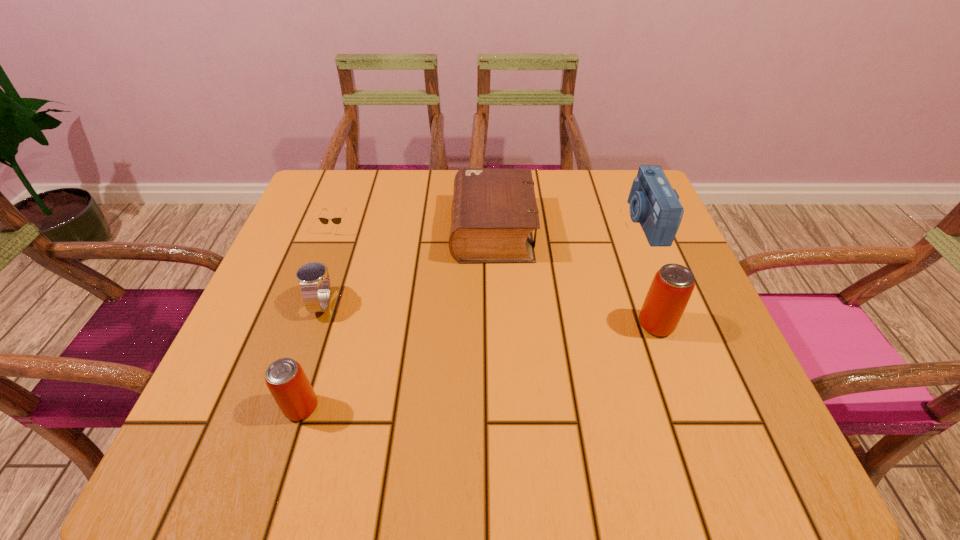
Find the location of a particular element. vacant space that satisfies the following two spatial constraints: 1. in front of the lenses of the sunglasses; 2. on the right side of the farther beer can is located at coordinates (302, 325).

You are a GUI agent. You are given a task and a screenshot of the screen. Output one action in this format:
    pyautogui.click(x=<x>, y=<y>)
    Task: Click on the vacant area that satisfies the following two spatial constraints: 1. in front of the lenses of the shortest object; 2. on the left side of the shorter beer can
    The image size is (960, 540).
    Given the screenshot: What is the action you would take?
    tap(273, 408)

Where is `vacant region that satisfies the following two spatial constraints: 1. on the spine side of the right beer can; 2. on the left side of the Bible`? vacant region that satisfies the following two spatial constraints: 1. on the spine side of the right beer can; 2. on the left side of the Bible is located at coordinates (495, 325).

The image size is (960, 540). I want to click on vacant area in the image that satisfies the following two spatial constraints: 1. in front of the lenses of the nearest object; 2. on the right side of the sunglasses, so click(273, 408).